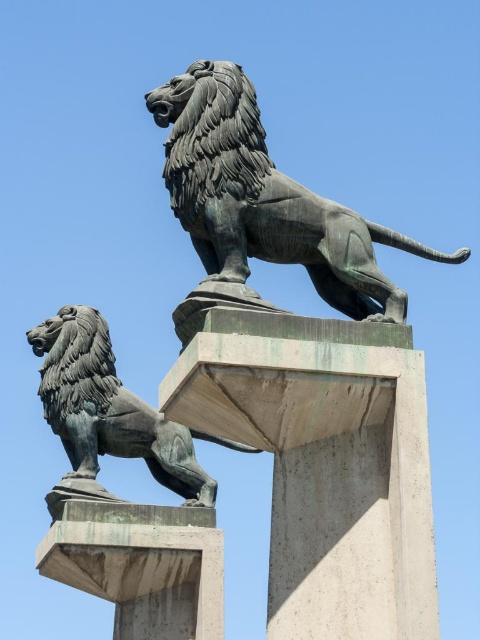
Question: Based on their relative distances, which object is farther from the bronze lion at upper center?

Choices:
 (A) concrete at center
 (B) sanded concrete pillar at center

Answer: (A)

Question: Does sanded concrete pillar at center have a larger size compared to concrete at center?

Choices:
 (A) yes
 (B) no

Answer: (B)

Question: Which point appears farthest from the camera in this image?

Choices:
 (A) (262, 396)
 (B) (124, 394)

Answer: (B)

Question: Is sanded concrete pillar at center thinner than bronze lion at lower left?

Choices:
 (A) no
 (B) yes

Answer: (B)

Question: Considering the relative positions of bronze lion at upper center and concrete at center in the image provided, where is bronze lion at upper center located with respect to concrete at center?

Choices:
 (A) above
 (B) below

Answer: (A)

Question: Among these objects, which one is farthest from the camera?

Choices:
 (A) concrete at center
 (B) bronze lion at upper center
 (C) sanded concrete pillar at center
 (D) bronze lion at lower left

Answer: (D)